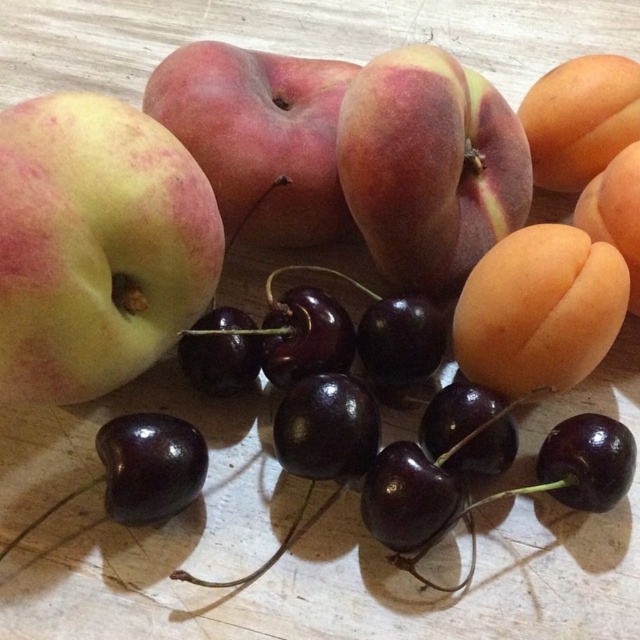
Question: Among these points, which one is nearest to the camera?

Choices:
 (A) click(548, 134)
 (B) click(35, 173)
 (C) click(260, 96)
 (D) click(371, 188)

Answer: (B)

Question: Is matte peach at center positioned before matte green apple at center?

Choices:
 (A) yes
 (B) no

Answer: (A)

Question: Which object is farther from the camera taking this photo?

Choices:
 (A) matte yellow apple at center
 (B) matte peach at center
 (C) matte green apple at center
 (D) orange matte/apricot at right

Answer: (D)

Question: Which point is closer to the camera?

Choices:
 (A) orange matte/apricot at right
 (B) matte yellow apple at center
 (C) matte peach at center

Answer: (B)

Question: From the image, what is the correct spatial relationship of matte green apple at center in relation to orange matte/apricot at right?

Choices:
 (A) above
 (B) below

Answer: (B)

Question: Is matte yellow apple at center wider than matte green apple at center?

Choices:
 (A) no
 (B) yes

Answer: (A)